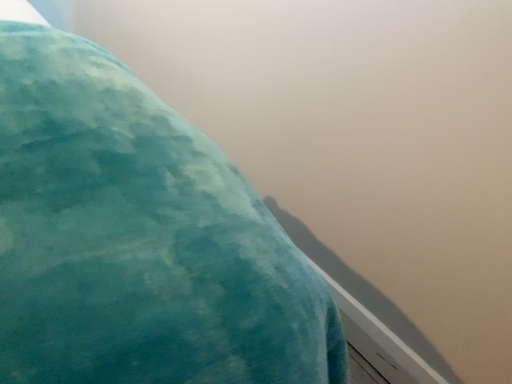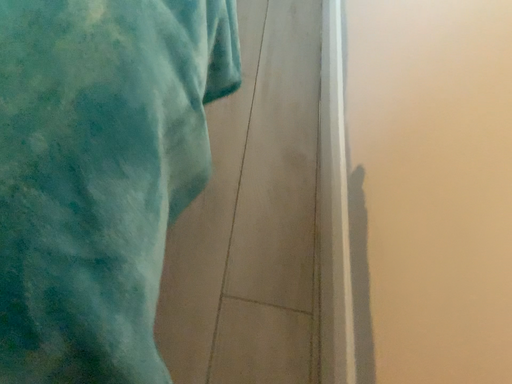
Question: Which way did the camera rotate in the video?

Choices:
 (A) rotated right
 (B) rotated left

Answer: (B)